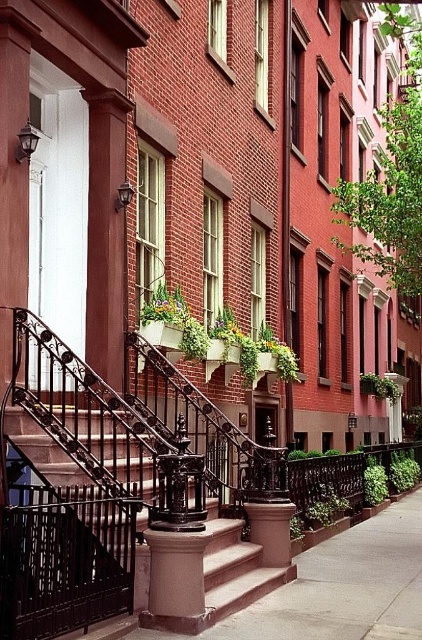
What do you see at coordinates (332, 589) in the screenshot?
I see `smooth concrete steps at center` at bounding box center [332, 589].

Describe the element at coordinates (332, 589) in the screenshot. Image resolution: width=422 pixels, height=640 pixels. I see `smooth concrete steps at center` at that location.

Locate an element on the screen. The height and width of the screenshot is (640, 422). smooth concrete steps at center is located at coordinates (332, 589).